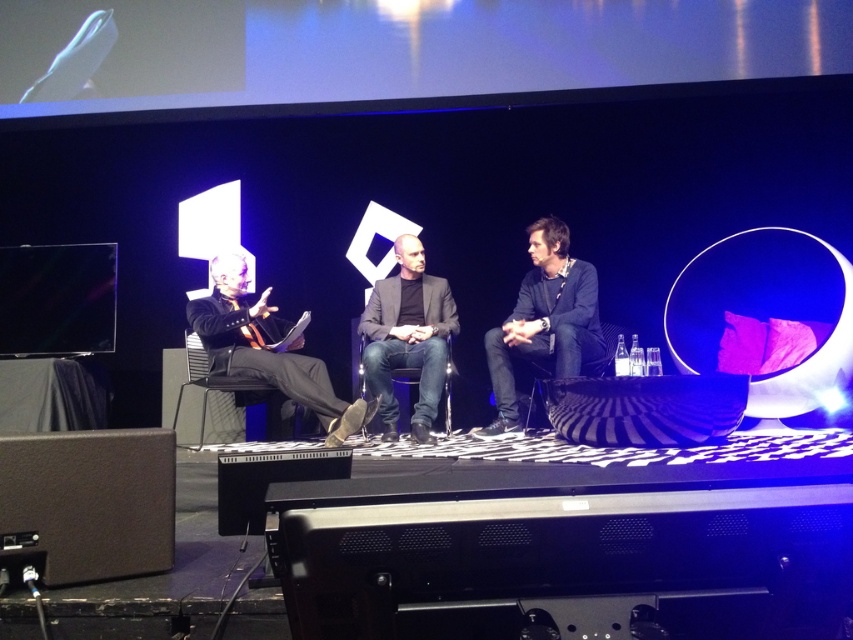
Which is more to the right, black leather chair at center or black leather chair at left?

Positioned to the right is black leather chair at center.

This screenshot has height=640, width=853. Describe the element at coordinates (405, 368) in the screenshot. I see `black leather chair at center` at that location.

Find the location of `black leather chair at center`. black leather chair at center is located at coordinates (405, 368).

Is black matte jacket at center above black fabric chair at center?

Yes.

Who is higher up, black matte jacket at center or black fabric chair at center?

black matte jacket at center is higher up.

This screenshot has height=640, width=853. In order to click on black matte jacket at center in this screenshot , I will do `click(543, 321)`.

Locate an element on the screen. The height and width of the screenshot is (640, 853). black matte jacket at center is located at coordinates (543, 321).

Is black leather jacket at left smaller than black leather chair at center?

No, black leather jacket at left is not smaller than black leather chair at center.

Where is `black leather jacket at left`? Image resolution: width=853 pixels, height=640 pixels. black leather jacket at left is located at coordinates (265, 348).

Find the location of a particular element. The width and height of the screenshot is (853, 640). black leather jacket at left is located at coordinates (265, 348).

At what (x,y) coordinates should I click in order to perform the action: click on black leather jacket at left. Please return your answer as a coordinate pair (x, y). Looking at the image, I should click on (265, 348).